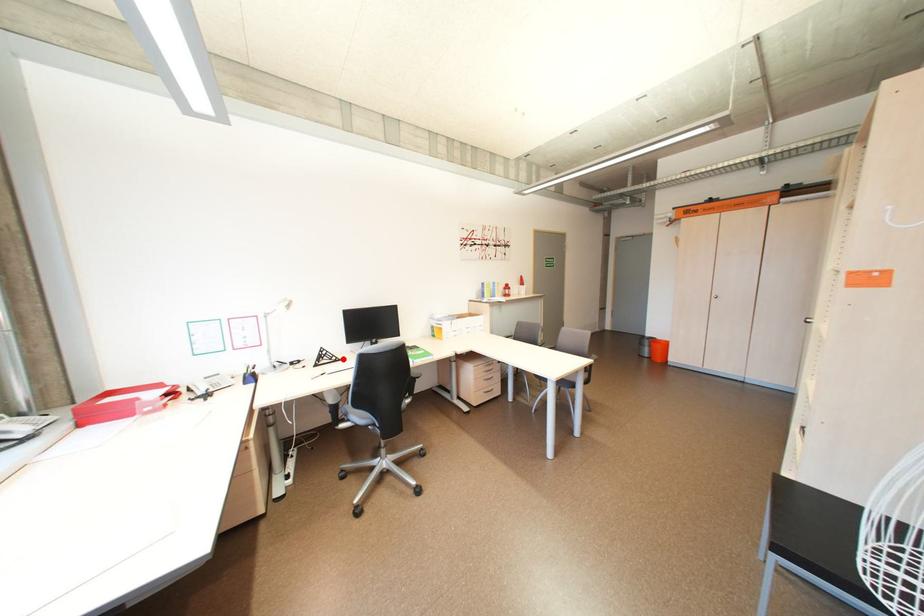
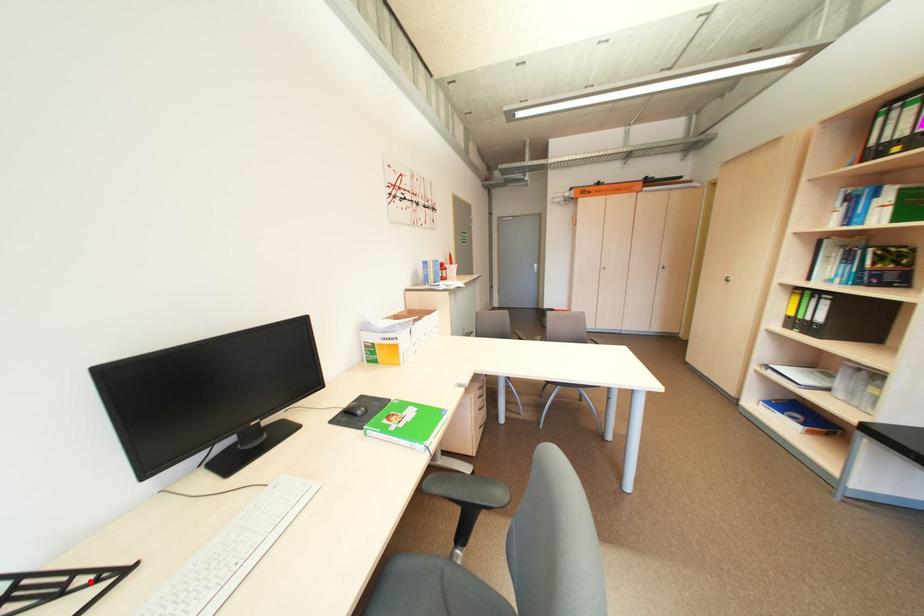
From the picture: I am providing you with two images of the same scene from different viewpoints. A red point is marked on the first image and another point is marked on the second image. Are the points marked in image1 and image2 representing the same 3D position?

Yes